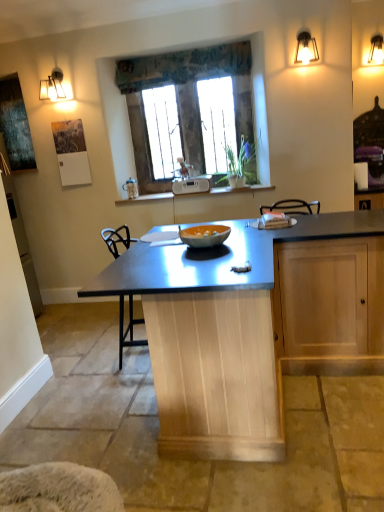
Identify the location of vacant area situated to the left side of metallic blue table at center. (81, 386).